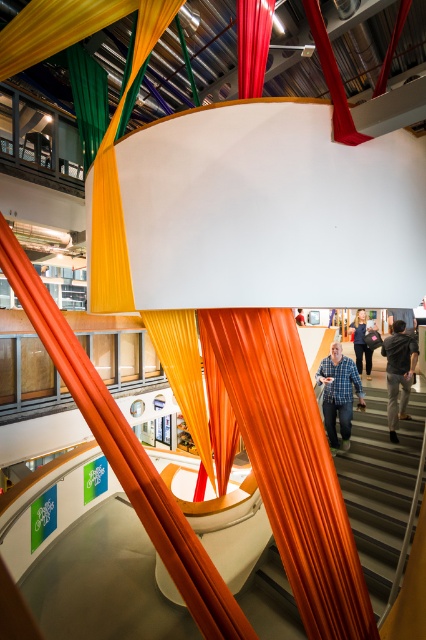
Can you confirm if red silk curtain at center is shorter than dark gray shirt at upper center?

Indeed, red silk curtain at center has a lesser height compared to dark gray shirt at upper center.

What do you see at coordinates (253, 44) in the screenshot? I see `red silk curtain at center` at bounding box center [253, 44].

Is point (241, 88) closer to camera compared to point (393, 401)?

Yes, it is in front of point (393, 401).

You are a GUI agent. You are given a task and a screenshot of the screen. Output one action in this format:
    pyautogui.click(x=<x>, y=<y>)
    Task: Click on the red silk curtain at center
    The width and height of the screenshot is (426, 640).
    Given the screenshot: What is the action you would take?
    pyautogui.click(x=253, y=44)

Which of these two, orange fabric curtain at center or dark gray shirt at upper center, stands shorter?

Standing shorter between the two is dark gray shirt at upper center.

Is orange fabric curtain at center positioned in front of dark gray shirt at upper center?

Yes, orange fabric curtain at center is closer to the viewer.

Who is more distant from viewer, [310,634] or [411,364]?

Point [411,364]

What are the coordinates of `orange fabric curtain at center` in the screenshot? It's located at (293, 467).

Is orange fabric at lower center further to camera compared to blue plaid shirt at center?

No.

Who is positioned more to the left, orange fabric at lower center or blue plaid shirt at center?

From the viewer's perspective, blue plaid shirt at center appears more on the left side.

The image size is (426, 640). What are the coordinates of `orange fabric at lower center` in the screenshot? It's located at (379, 486).